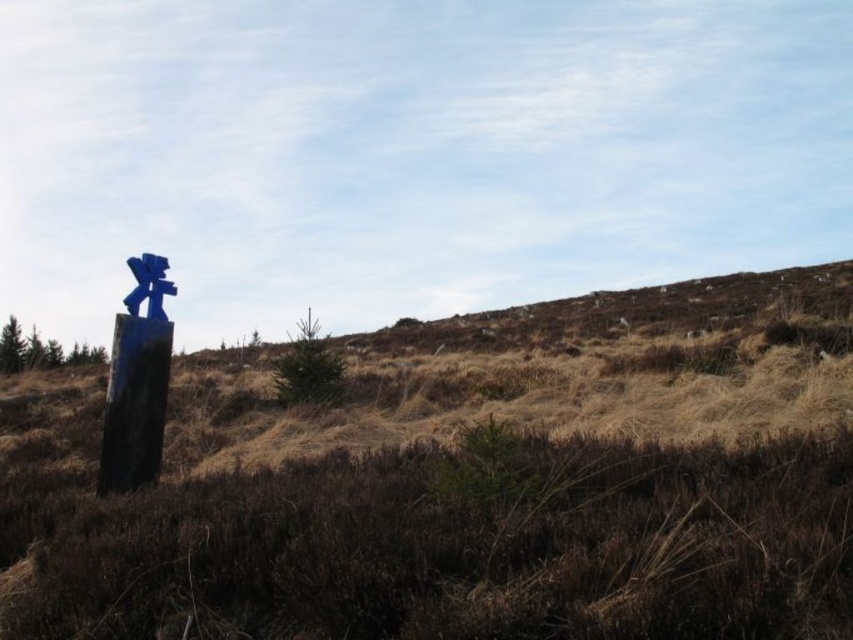
You are a hiker who wants to place a 10 cm tall hiking pole next to the brown dry grass at left and the blue painted wood signpost at left. Which object will the pole be taller than?

The brown dry grass at left has a greater height compared to the blue painted wood signpost at left. The hiking pole is 10 cm tall. Since the brown dry grass at left is taller than the blue painted wood signpost at left, the pole will be taller than the blue painted wood signpost at left if the signpost is shorter than 10 cm. However, without specific measurements for the signpost, we can only conclude that the pole will be taller than the shorter object between the two. Since the grass is taller than the

You are standing at the base of the blue sculpture in the midground and want to walk towards the direction of the point labeled as point (55, 605). Which direction should you walk relative to the other point labeled point (148, 445)?

Point (55, 605) is in front of point (148, 445), so you should walk towards the direction of point (55, 605) which is ahead of point (148, 445).